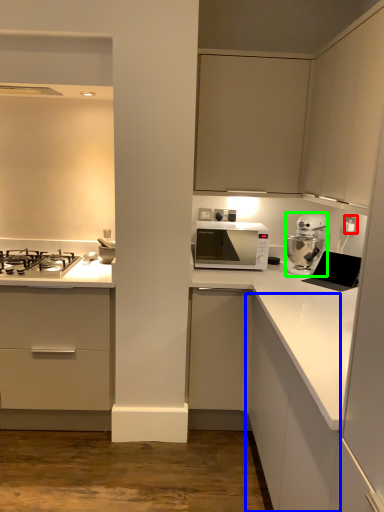
Question: Which object is the farthest from electric outlet (highlighted by a red box)? Choose among these: cabinetry (highlighted by a blue box) or kitchen appliance (highlighted by a green box).

Choices:
 (A) cabinetry
 (B) kitchen appliance

Answer: (A)